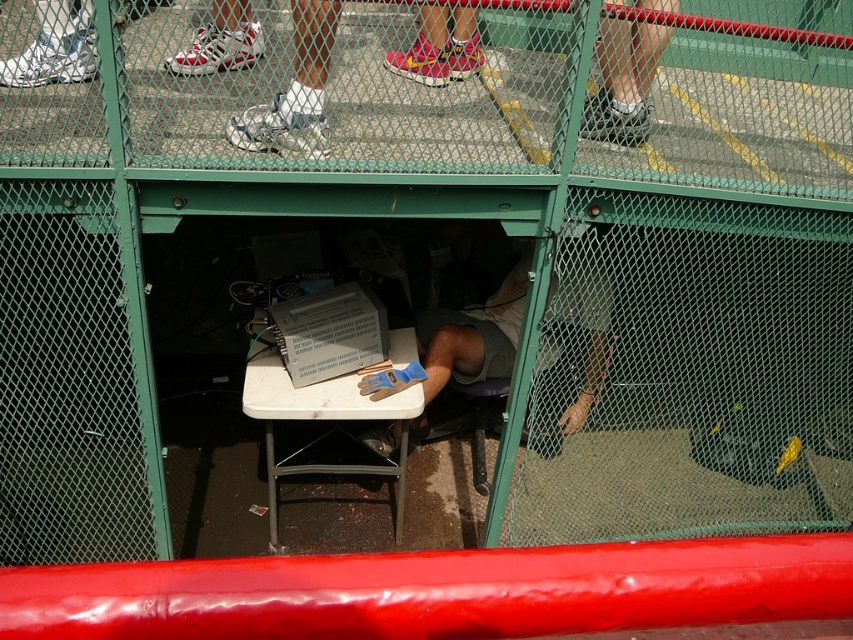
Is white plastic table at center bigger than white fabric socks at upper right?

Yes.

Does point (300, 403) lie in front of point (614, 113)?

That is False.

At what (x,y) coordinates should I click in order to perform the action: click on white plastic table at center. Please return your answer as a coordinate pair (x, y). Looking at the image, I should click on coord(320,419).

The height and width of the screenshot is (640, 853). I want to click on white plastic table at center, so click(x=320, y=419).

Image resolution: width=853 pixels, height=640 pixels. Identify the location of gray fabric shirt at center. (474, 333).

Does gray fabric shirt at center have a lesser width compared to white plastic table at center?

Yes.

Is point (457, 362) closer to camera compared to point (401, 515)?

No, (457, 362) is further to viewer.

The height and width of the screenshot is (640, 853). I want to click on gray fabric shirt at center, so click(x=474, y=333).

From the picture: Can you confirm if gray fabric shirt at center is shorter than white fabric socks at upper right?

No.

Locate an element on the screen. The height and width of the screenshot is (640, 853). gray fabric shirt at center is located at coordinates (474, 333).

This screenshot has height=640, width=853. What do you see at coordinates (474, 333) in the screenshot?
I see `gray fabric shirt at center` at bounding box center [474, 333].

Find the location of a particular element. The image size is (853, 640). gray fabric shirt at center is located at coordinates (474, 333).